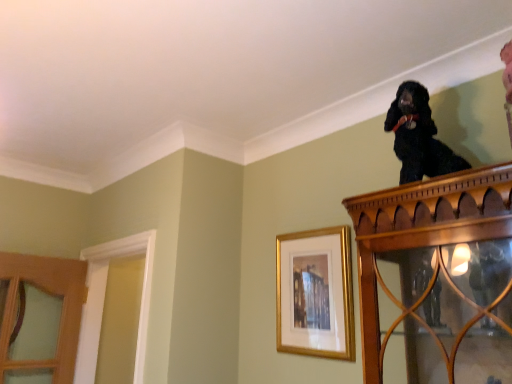
What do you see at coordinates (418, 136) in the screenshot? The width and height of the screenshot is (512, 384). I see `black silky dog at upper right` at bounding box center [418, 136].

At what (x,y) coordinates should I click in order to perform the action: click on white wood door frame at left. Please return your answer as a coordinate pair (x, y). The height and width of the screenshot is (384, 512). Looking at the image, I should click on (104, 299).

From the image's perspective, which object appears higher, black silky dog at upper right or white wood door frame at left?

black silky dog at upper right.

How many degrees apart are the facing directions of black silky dog at upper right and white wood door frame at left?

They differ by 3.14 degrees in their facing directions.

Considering the positions of objects black silky dog at upper right and white wood door frame at left in the image provided, who is behind, black silky dog at upper right or white wood door frame at left?

white wood door frame at left is further away from the camera.

Is black silky dog at upper right shorter than white wood door frame at left?

Yes, black silky dog at upper right is shorter than white wood door frame at left.

Based on the photo, does white wood door frame at left lie behind gold framed picture at upper center?

That is True.

From a real-world perspective, is white wood door frame at left positioned over gold framed picture at upper center based on gravity?

Incorrect, from a real-world perspective, white wood door frame at left is lower than gold framed picture at upper center.

Between point (148, 268) and point (327, 286), which one is positioned in front?

Positioned in front is point (327, 286).

From the image's perspective, is white wood door frame at left above gold framed picture at upper center?

Incorrect, from the image's perspective, white wood door frame at left is lower than gold framed picture at upper center.

Who is shorter, gold framed picture at upper center or white wood door frame at left?

With less height is gold framed picture at upper center.

How much distance is there between gold framed picture at upper center and white wood door frame at left?

gold framed picture at upper center and white wood door frame at left are 80.58 centimeters apart from each other.

Is gold framed picture at upper center smaller than white wood door frame at left?

Yes.

Is point (340, 300) farther from camera compared to point (142, 336)?

No, (340, 300) is closer to viewer.

Which of these two, black silky dog at upper right or gold framed picture at upper center, stands shorter?

With less height is black silky dog at upper right.

Are black silky dog at upper right and gold framed picture at upper center located far from each other?

No, black silky dog at upper right is not far from gold framed picture at upper center.

Locate an element on the screen. The height and width of the screenshot is (384, 512). picture frame behind the black silky dog at upper right is located at coordinates (315, 293).

How distant is black silky dog at upper right from gold framed picture at upper center?

A distance of 58.89 centimeters exists between black silky dog at upper right and gold framed picture at upper center.

Looking at this image, from the image's perspective, is gold framed picture at upper center located above or below black silky dog at upper right?

gold framed picture at upper center is below black silky dog at upper right.

Can you confirm if gold framed picture at upper center is smaller than black silky dog at upper right?

Correct, gold framed picture at upper center occupies less space than black silky dog at upper right.

Is gold framed picture at upper center at the left side of black silky dog at upper right?

Correct, you'll find gold framed picture at upper center to the left of black silky dog at upper right.

Does gold framed picture at upper center turn towards black silky dog at upper right?

No, gold framed picture at upper center is not aimed at black silky dog at upper right.

From a real-world perspective, is white wood door frame at left positioned above or below black silky dog at upper right?

Clearly, from a real-world perspective, white wood door frame at left is below black silky dog at upper right.

Between white wood door frame at left and black silky dog at upper right, which one has more height?

white wood door frame at left.

Does white wood door frame at left turn towards black silky dog at upper right?

No, white wood door frame at left is not aimed at black silky dog at upper right.

How many degrees apart are the facing directions of white wood door frame at left and black silky dog at upper right?

The facing directions of white wood door frame at left and black silky dog at upper right are 3.14 degrees apart.

The height and width of the screenshot is (384, 512). I want to click on window frame on the left of black silky dog at upper right, so click(104, 299).

Where is `picture frame on the right of the white wood door frame at left`? This screenshot has width=512, height=384. picture frame on the right of the white wood door frame at left is located at coordinates point(315,293).

Consider the image. Looking at the image, which one is located further to gold framed picture at upper center, black silky dog at upper right or white wood door frame at left?

white wood door frame at left lies further to gold framed picture at upper center than the other object.

Estimate the real-world distances between objects in this image. Which object is further from black silky dog at upper right, white wood door frame at left or gold framed picture at upper center?

white wood door frame at left is further to black silky dog at upper right.

From the picture: From the image, which object appears to be nearer to black silky dog at upper right, gold framed picture at upper center or white wood door frame at left?

gold framed picture at upper center is positioned closer to the anchor black silky dog at upper right.

Based on their spatial positions, is white wood door frame at left or black silky dog at upper right further from gold framed picture at upper center?

Among the two, white wood door frame at left is located further to gold framed picture at upper center.

Considering their positions, is black silky dog at upper right positioned closer to white wood door frame at left than gold framed picture at upper center?

gold framed picture at upper center is closer to white wood door frame at left.

Estimate the real-world distances between objects in this image. Which object is further from white wood door frame at left, gold framed picture at upper center or black silky dog at upper right?

black silky dog at upper right is further to white wood door frame at left.

The width and height of the screenshot is (512, 384). Identify the location of picture frame between white wood door frame at left and black silky dog at upper right from left to right. (315, 293).